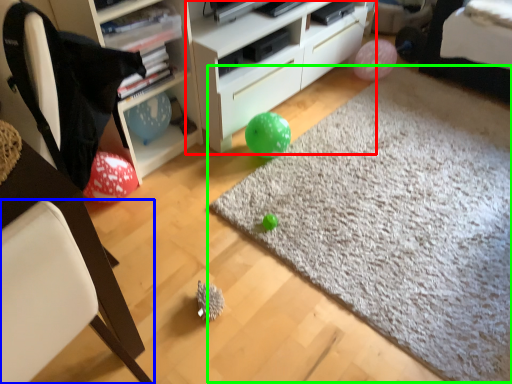
Question: Which object is the farthest from cabinetry (highlighted by a red box)? Choose among these: chair (highlighted by a blue box) or plain (highlighted by a green box).

Choices:
 (A) chair
 (B) plain

Answer: (A)